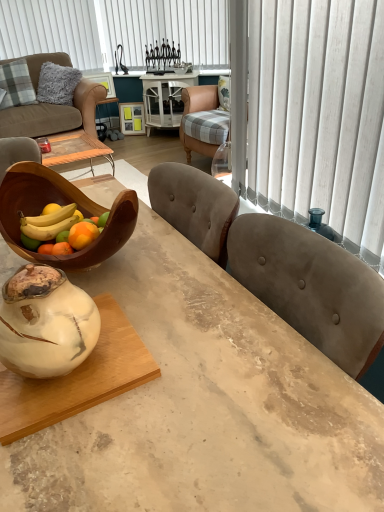
Question: In terms of size, does white vertical blinds at upper center appear bigger or smaller than plaid fabric pillow at upper left?

Choices:
 (A) small
 (B) big

Answer: (A)

Question: Visually, is white vertical blinds at upper center positioned to the left or to the right of plaid fabric pillow at upper left?

Choices:
 (A) left
 (B) right

Answer: (B)

Question: Based on their relative distances, which object is farther from the white marble round table at center?

Choices:
 (A) plaid fabric pillow at upper left
 (B) brown leather couch at upper left
 (C) white marble coffee table at lower left
 (D) white marble vase at center
 (E) white vertical blinds at upper center

Answer: (D)

Question: Based on their relative distances, which object is farther from the plaid fabric pillow at upper left?

Choices:
 (A) marble table at center
 (B) white marble round table at center
 (C) wooden bowl at left
 (D) brown leather couch at upper left
 (E) white marble coffee table at lower left

Answer: (E)